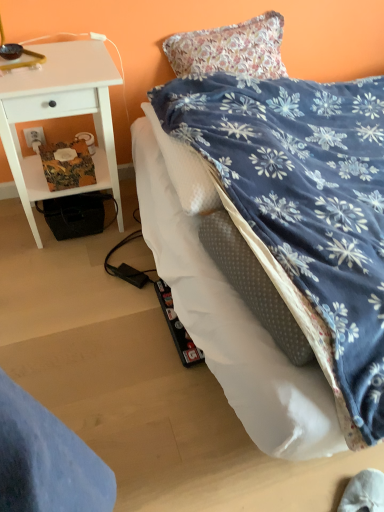
Question: Is white plastic power outlet at lower left not close to white wood desk at left?

Choices:
 (A) yes
 (B) no

Answer: (B)

Question: Is white plastic power outlet at lower left thinner than white wood desk at left?

Choices:
 (A) yes
 (B) no

Answer: (A)

Question: Is the surface of white plastic power outlet at lower left in direct contact with white wood desk at left?

Choices:
 (A) yes
 (B) no

Answer: (B)

Question: Is white plastic power outlet at lower left facing towards white wood desk at left?

Choices:
 (A) yes
 (B) no

Answer: (A)

Question: From a real-world perspective, is white plastic power outlet at lower left positioned under white wood desk at left based on gravity?

Choices:
 (A) no
 (B) yes

Answer: (B)

Question: Looking at their shapes, would you say white wood desk at left is wider or thinner than blue velvety bed at center?

Choices:
 (A) thin
 (B) wide

Answer: (A)

Question: Is white wood desk at left inside or outside of blue velvety bed at center?

Choices:
 (A) inside
 (B) outside

Answer: (B)

Question: In terms of size, does white wood desk at left appear bigger or smaller than blue velvety bed at center?

Choices:
 (A) big
 (B) small

Answer: (B)

Question: Visually, is white wood desk at left positioned to the left or to the right of blue velvety bed at center?

Choices:
 (A) left
 (B) right

Answer: (A)

Question: From a real-world perspective, is white plastic power outlet at lower left positioned above or below blue velvety bed at center?

Choices:
 (A) above
 (B) below

Answer: (B)

Question: From the image's perspective, is white plastic power outlet at lower left positioned above or below blue velvety bed at center?

Choices:
 (A) below
 (B) above

Answer: (B)

Question: Is white plastic power outlet at lower left bigger or smaller than blue velvety bed at center?

Choices:
 (A) big
 (B) small

Answer: (B)

Question: In terms of height, does white plastic power outlet at lower left look taller or shorter compared to blue velvety bed at center?

Choices:
 (A) tall
 (B) short

Answer: (B)

Question: From a real-world perspective, is blue velvety bed at center above or below white plastic power outlet at lower left?

Choices:
 (A) above
 (B) below

Answer: (A)

Question: In terms of width, does blue velvety bed at center look wider or thinner when compared to white plastic power outlet at lower left?

Choices:
 (A) thin
 (B) wide

Answer: (B)